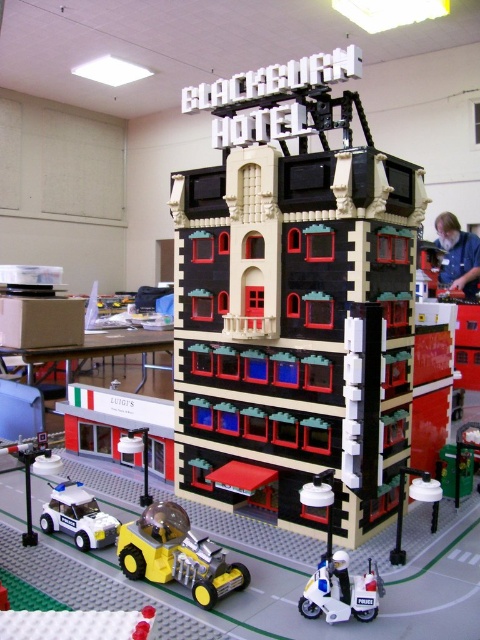
Does brick-patterned hotel at center come behind white plastic police scooter at lower center?

Yes, it is.

Can you confirm if brick-patterned hotel at center is wider than white plastic police scooter at lower center?

Indeed, brick-patterned hotel at center has a greater width compared to white plastic police scooter at lower center.

Find the location of a particular element. brick-patterned hotel at center is located at coordinates (295, 300).

Locate an element on the screen. brick-patterned hotel at center is located at coordinates (295, 300).

In the scene shown: Can you confirm if white plastic police scooter at lower center is smaller than white plastic police car at lower left?

No.

Who is higher up, white plastic police scooter at lower center or white plastic police car at lower left?

Positioned higher is white plastic police car at lower left.

What do you see at coordinates (340, 589) in the screenshot?
I see `white plastic police scooter at lower center` at bounding box center [340, 589].

Locate an element on the screen. white plastic police scooter at lower center is located at coordinates (340, 589).

This screenshot has height=640, width=480. What do you see at coordinates (177, 554) in the screenshot?
I see `yellow metallic toy car at center` at bounding box center [177, 554].

Who is more distant from viewer, (233, 576) or (312, 604)?

The point (233, 576) is behind.

This screenshot has width=480, height=640. What do you see at coordinates (177, 554) in the screenshot?
I see `yellow metallic toy car at center` at bounding box center [177, 554].

At what (x,y) coordinates should I click in order to perform the action: click on yellow metallic toy car at center. Please return your answer as a coordinate pair (x, y). Looking at the image, I should click on (177, 554).